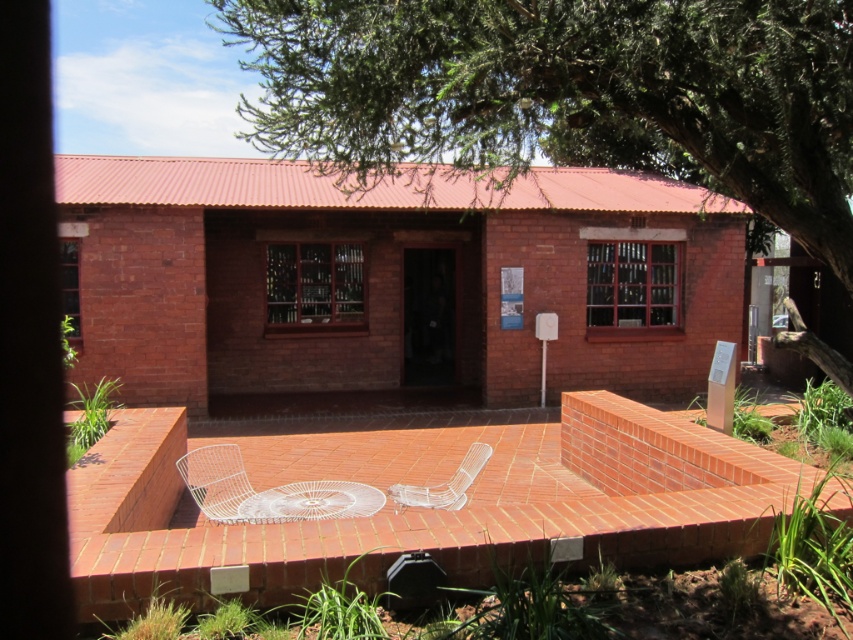
You are standing at the entrance of the brick building and want to sit down at the white wire table at center. Which direction should you walk to reach it while avoiding the green leafy tree at upper center?

You should walk to the right to reach the white wire table at center because the green leafy tree at upper center is located to the left of the table, so moving right would avoid it.